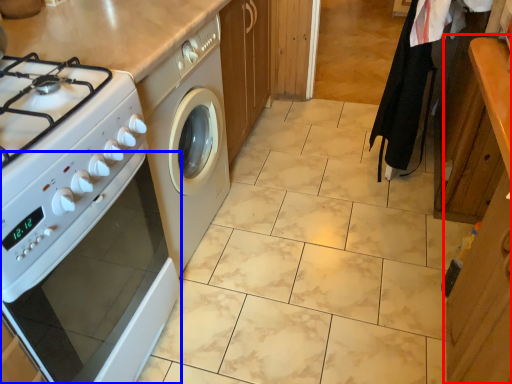
Question: Which object is further to the camera taking this photo, cabinetry (highlighted by a red box) or oven (highlighted by a blue box)?

Choices:
 (A) cabinetry
 (B) oven

Answer: (B)